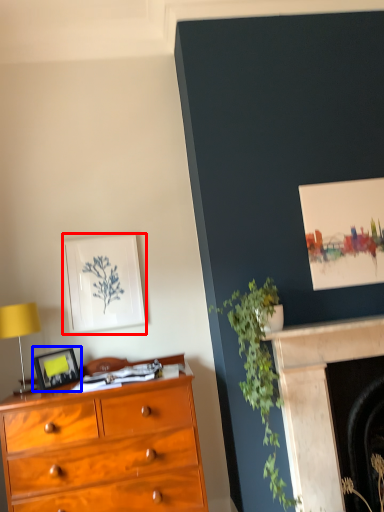
Question: Which point is further to the camera, picture frame (highlighted by a red box) or picture frame (highlighted by a blue box)?

Choices:
 (A) picture frame
 (B) picture frame

Answer: (A)